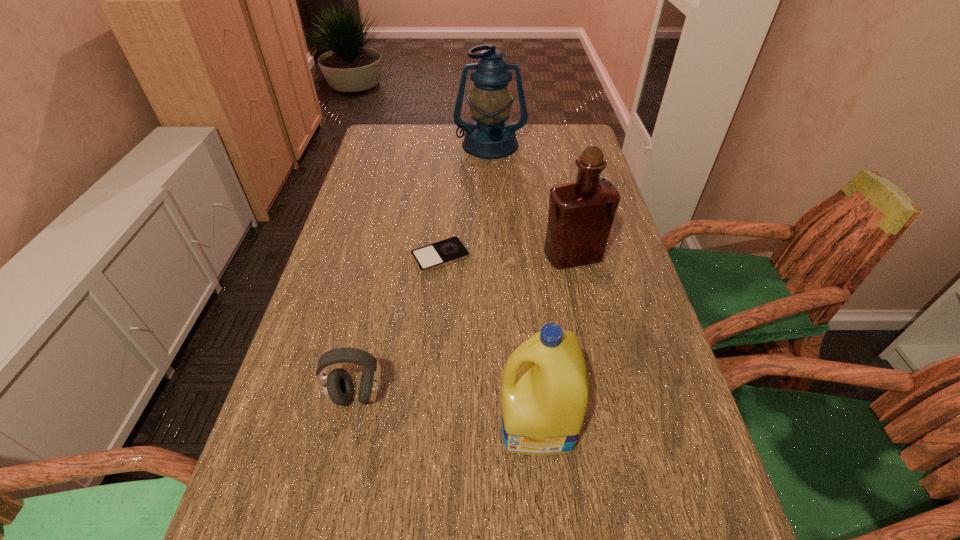
Choose which object is the fourth nearest neighbor to the lantern. Please provide its 2D coordinates. Your answer should be formatted as a tuple, i.e. [(x, y)], where the tuple contains the x and y coordinates of a point satisfying the conditions above.

[(544, 394)]

Identify the location of the fourth closest object to the liquor. The height and width of the screenshot is (540, 960). (338, 388).

Identify the location of free space that satisfies the following two spatial constraints: 1. on the face of the farthest object; 2. on the left side of the liquor. Image resolution: width=960 pixels, height=540 pixels. (493, 256).

At what (x,y) coordinates should I click in order to perform the action: click on vacant space that satisfies the following two spatial constraints: 1. on the front side of the shortest object; 2. on the left side of the liquor. Please return your answer as a coordinate pair (x, y). The height and width of the screenshot is (540, 960). Looking at the image, I should click on (441, 256).

At what (x,y) coordinates should I click in order to perform the action: click on vacant space that satisfies the following two spatial constraints: 1. on the face of the farthest object; 2. on the left side of the liquor. Please return your answer as a coordinate pair (x, y). The image size is (960, 540). Looking at the image, I should click on (493, 256).